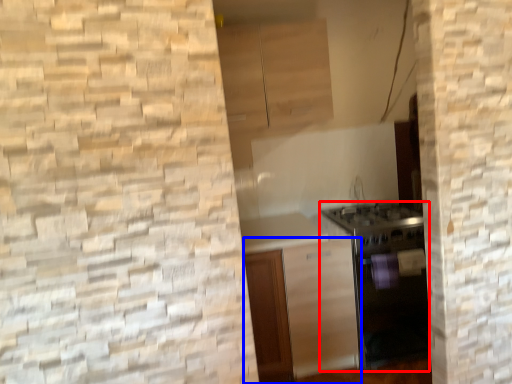
Question: Which point is further to the camera, oven (highlighted by a red box) or cabinetry (highlighted by a blue box)?

Choices:
 (A) oven
 (B) cabinetry

Answer: (A)